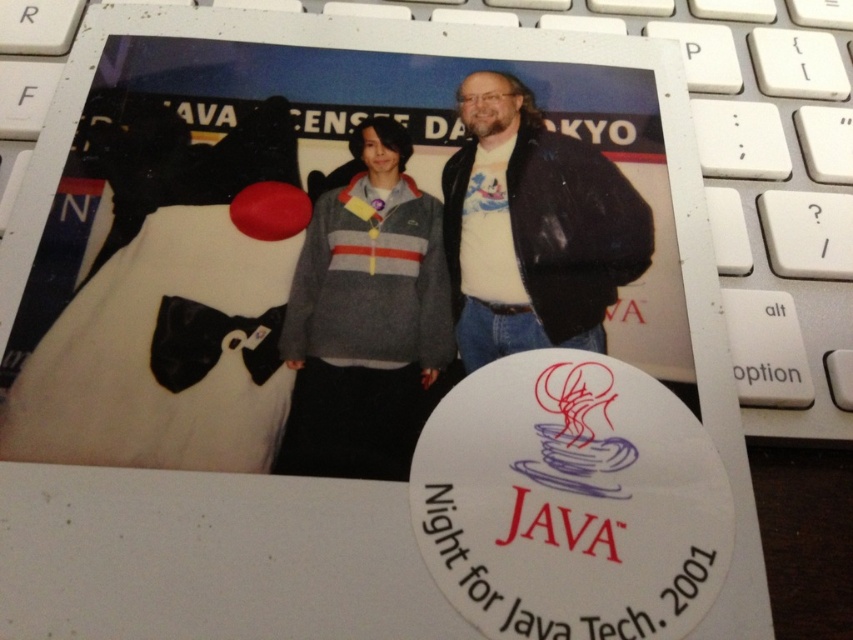
Can you confirm if gray fleece jacket at center is smaller than matte black jacket at center?

Incorrect, gray fleece jacket at center is not smaller in size than matte black jacket at center.

Can you confirm if gray fleece jacket at center is wider than matte black jacket at center?

Indeed, gray fleece jacket at center has a greater width compared to matte black jacket at center.

Does point (415, 221) lie behind point (474, 358)?

Yes, point (415, 221) is farther from viewer.

Find the location of a particular element. The width and height of the screenshot is (853, 640). gray fleece jacket at center is located at coordinates (451, 276).

Measure the distance between point (352,312) and camera.

The distance of point (352,312) from camera is 21.08 inches.

Which is more to the right, gray fleece jacket at center or white plastic laptop keyboard at center?

gray fleece jacket at center is more to the right.

Is point (540, 227) less distant than point (701, 100)?

That is True.

In order to click on gray fleece jacket at center in this screenshot , I will do `click(451, 276)`.

Is white plastic laptop keyboard at center below matte black jacket at center?

No, white plastic laptop keyboard at center is not below matte black jacket at center.

Can you confirm if white plastic laptop keyboard at center is positioned to the right of matte black jacket at center?

In fact, white plastic laptop keyboard at center is to the left of matte black jacket at center.

Who is more distant from viewer, [749,328] or [583,282]?

Positioned behind is point [749,328].

Locate an element on the screen. white plastic laptop keyboard at center is located at coordinates (741, 173).